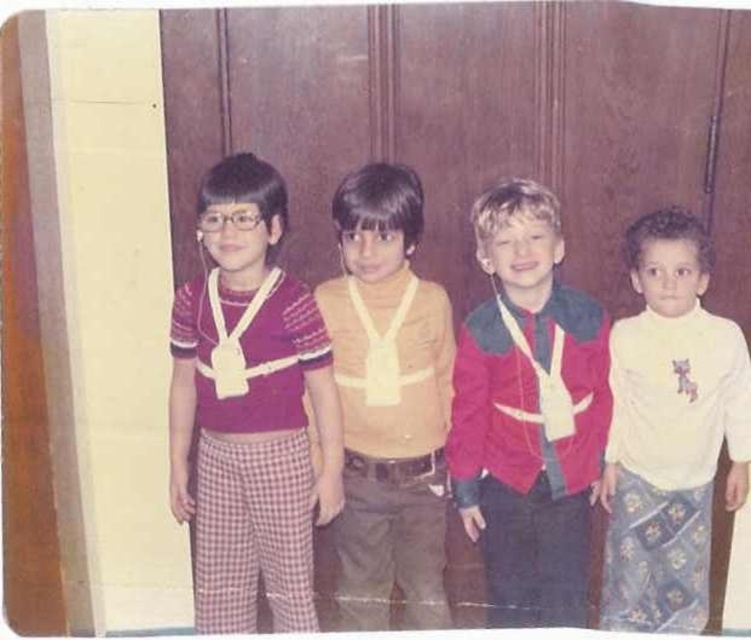
Question: Does matte yellow shirt at center come in front of matte white necktie at center?

Choices:
 (A) yes
 (B) no

Answer: (B)

Question: Which point appears closest to the camera in this image?

Choices:
 (A) (481, 259)
 (B) (710, 468)
 (C) (222, 563)
 (D) (264, 273)

Answer: (D)

Question: Which object is the farthest from the matte yellow shirt at center?

Choices:
 (A) matte white necktie at center
 (B) white soft turtleneck at right

Answer: (B)

Question: Which of the following is the closest to the observer?

Choices:
 (A) (614, 621)
 (B) (267, 269)
 (C) (179, 324)

Answer: (B)

Question: Can you confirm if matte red sweater at left is positioned to the right of matte red jacket at center?

Choices:
 (A) yes
 (B) no

Answer: (B)

Question: Does matte yellow shirt at center come behind white soft turtleneck at right?

Choices:
 (A) no
 (B) yes

Answer: (A)